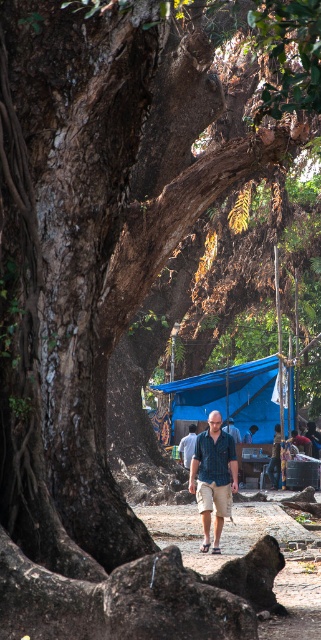
You are standing in front of the large tree and looking at the blue tarpaulin at center and the blue shirt at center. Which object is nearer to you?

The blue tarpaulin at center is closer to the viewer than the blue shirt at center, so the blue tarpaulin at center is nearer to you.